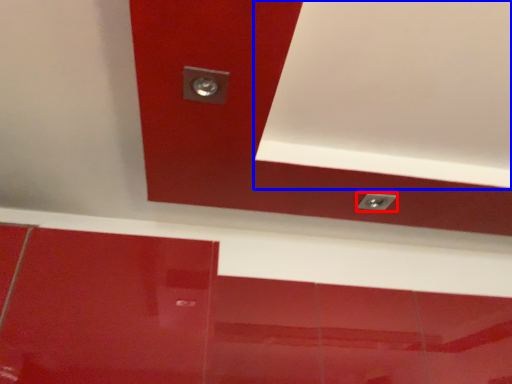
Question: Which object appears closest to the camera in this image, knob (highlighted by a red box) or exhaust hood (highlighted by a blue box)?

Choices:
 (A) knob
 (B) exhaust hood

Answer: (B)